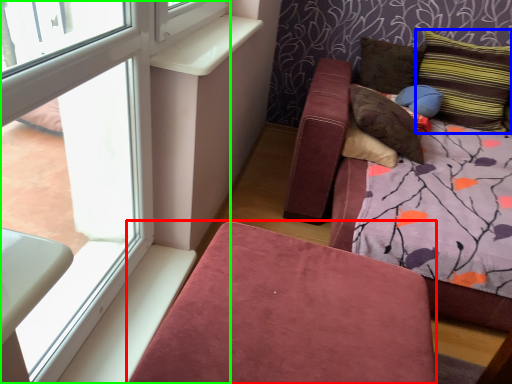
Question: Which is farther away from furniture (highlighted by a red box)? pillow (highlighted by a blue box) or window (highlighted by a green box)?

Choices:
 (A) pillow
 (B) window

Answer: (A)